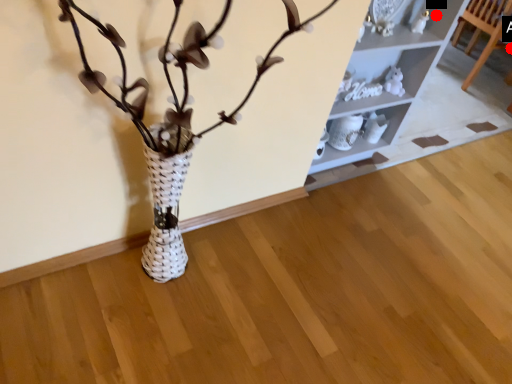
Question: Two points are circled on the image, labeled by A and B beside each circle. Among these points, which one is farthest from the camera?

Choices:
 (A) A is further
 (B) B is further

Answer: (A)